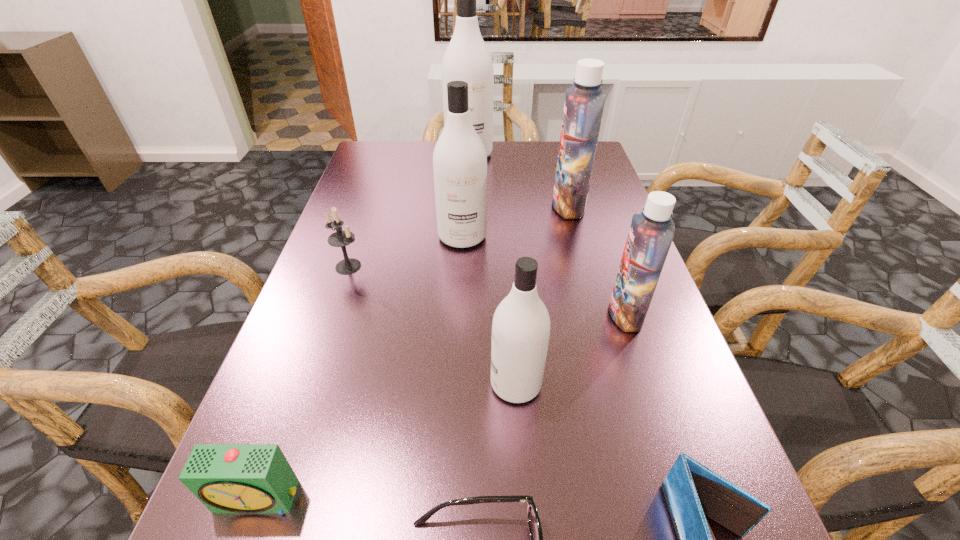
The height and width of the screenshot is (540, 960). Find the location of `the farthest object`. the farthest object is located at coordinates (467, 58).

What are the coordinates of `the tallest shampoo` in the screenshot? It's located at (467, 58).

The width and height of the screenshot is (960, 540). Find the location of `the farther blue shampoo`. the farther blue shampoo is located at coordinates (584, 102).

This screenshot has height=540, width=960. Find the location of `the second smallest white shampoo`. the second smallest white shampoo is located at coordinates (459, 159).

The width and height of the screenshot is (960, 540). Identify the location of the smaller blue shampoo. tap(651, 233).

Where is `the fifth nearest object`? The height and width of the screenshot is (540, 960). the fifth nearest object is located at coordinates coord(651,233).

I want to click on the smallest white shampoo, so click(x=520, y=333).

Identify the location of the nearest shampoo. The height and width of the screenshot is (540, 960). (520, 333).

Locate an element on the screen. The width and height of the screenshot is (960, 540). the fourth farthest object is located at coordinates (341, 238).

This screenshot has width=960, height=540. What are the coordinates of `candle holder` in the screenshot? It's located at (341, 238).